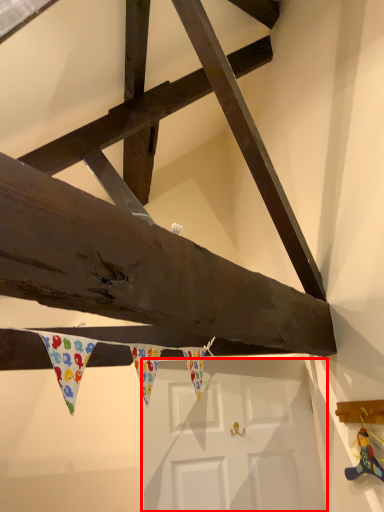
Question: From the image's perspective, considering the relative positions of door (annotated by the red box) and toy in the image provided, where is door (annotated by the red box) located with respect to the staircase?

Choices:
 (A) above
 (B) below

Answer: (B)